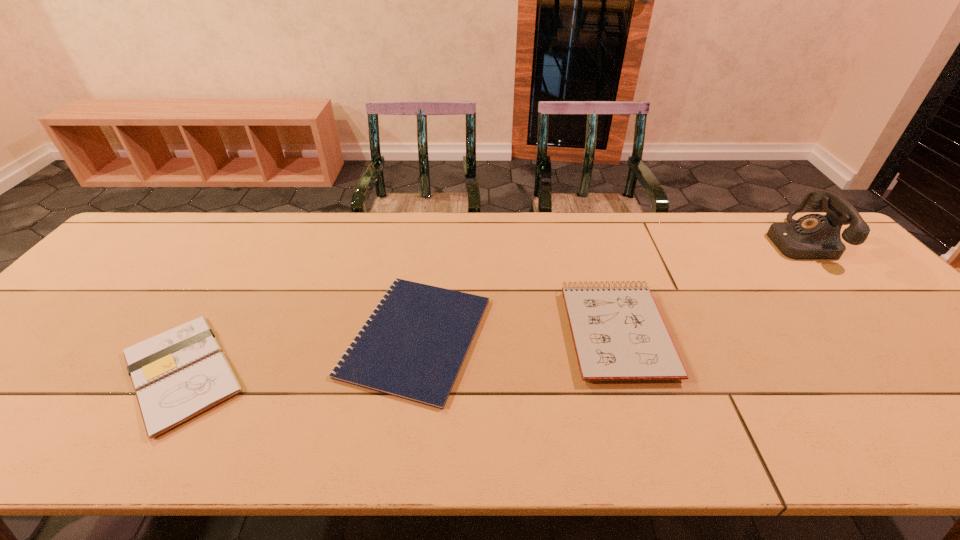
The width and height of the screenshot is (960, 540). What are the coordinates of `free space at the right edge of the desktop` in the screenshot? It's located at (905, 352).

Image resolution: width=960 pixels, height=540 pixels. I want to click on vacant area between the leftmost object and the telephone, so click(490, 307).

The height and width of the screenshot is (540, 960). Find the location of `free space between the leftmost notepad and the telephone`. free space between the leftmost notepad and the telephone is located at coordinates (490, 307).

Identify the location of vacant point located between the shortest object and the third shortest object. The image size is (960, 540). (516, 334).

This screenshot has height=540, width=960. I want to click on free spot between the leftmost object and the farthest object, so click(490, 307).

In order to click on vacant region between the second notepad from left to right and the leftmost notepad in this screenshot , I will do coord(299,355).

This screenshot has height=540, width=960. I want to click on free space between the rightmost object and the second tallest object, so click(708, 286).

The height and width of the screenshot is (540, 960). What are the coordinates of `object that can be found as the third closest to the leftmost notepad` in the screenshot? It's located at (814, 236).

Locate which object is the third closest to the third object from right to left. Please provide its 2D coordinates. Your answer should be formatted as a tuple, i.e. [(x, y)], where the tuple contains the x and y coordinates of a point satisfying the conditions above.

[(814, 236)]

Select which notepad is the second closest to the telephone. Please provide its 2D coordinates. Your answer should be formatted as a tuple, i.e. [(x, y)], where the tuple contains the x and y coordinates of a point satisfying the conditions above.

[(412, 346)]